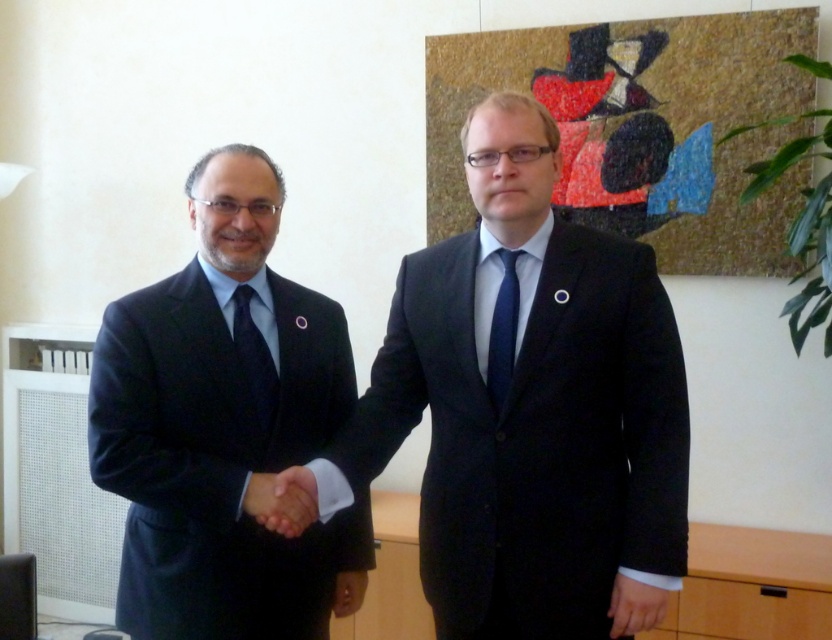
Question: Estimate the real-world distances between objects in this image. Which object is closer to the black matte hand at center?

Choices:
 (A) blue silk tie at center
 (B) matte black hand at lower right

Answer: (A)

Question: Can you confirm if black matte hand at center is bigger than matte black hand at lower center?

Choices:
 (A) no
 (B) yes

Answer: (A)

Question: Where is matte black suit at left located in relation to matte black hand at lower right in the image?

Choices:
 (A) left
 (B) right

Answer: (A)

Question: Is matte black suit at center in front of black matte hand at center?

Choices:
 (A) no
 (B) yes

Answer: (A)

Question: Among these points, which one is farthest from the camera?

Choices:
 (A) (542, 112)
 (B) (353, 605)
 (C) (503, 344)

Answer: (B)

Question: Which point is closer to the camera?

Choices:
 (A) (243, 380)
 (B) (503, 374)
 (C) (656, 588)
 (D) (300, 467)

Answer: (C)